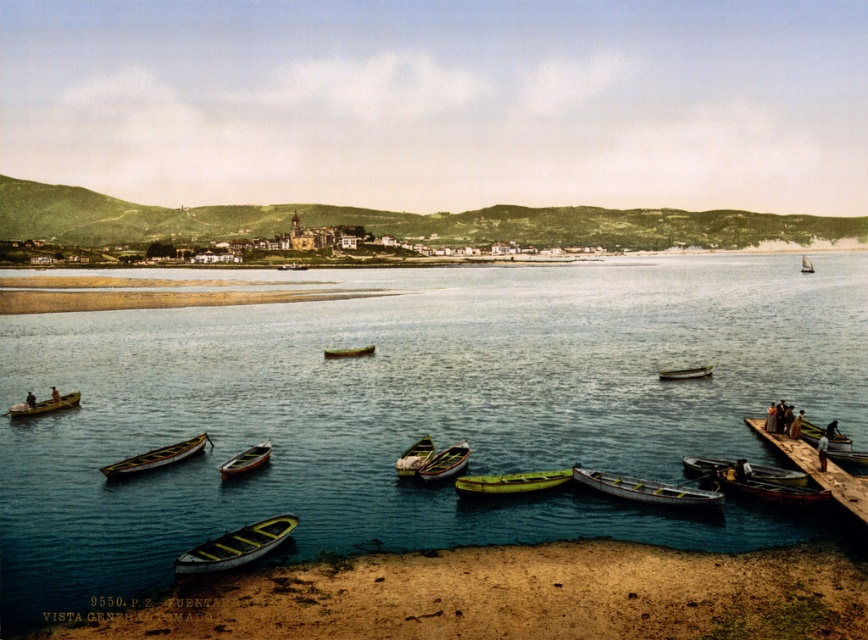
You are a photographer planning to take a photo of the wooden pier at lower right and the green matte boat at center. Which object should you focus on first if you want to capture both in a single frame without moving the camera?

You should focus on the wooden pier at lower right first because it is larger in size than the green matte boat at center, making it more prominent in the composition.

You are standing on the sand and see the smooth sand beach at lower left and the green matte boat at center. Which object is positioned to the right of the other?

The smooth sand beach at lower left is to the right of the green matte boat at center.

You are standing on the wooden pier at lower right and want to board the green matte boat at center. Is the boat directly above the pier?

Yes, the wooden pier at lower right is positioned under the green matte boat at center, so the boat is directly above the pier.